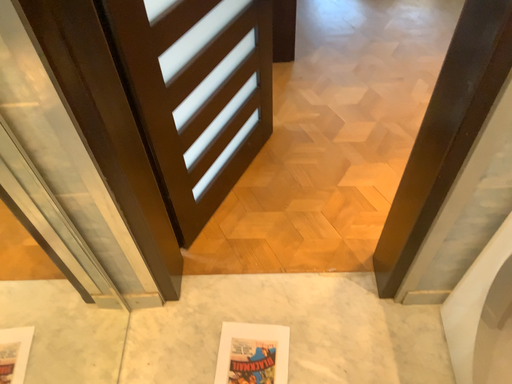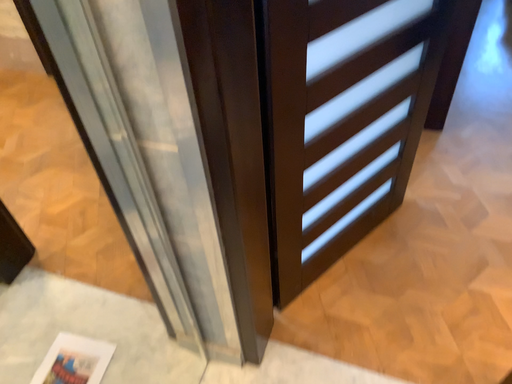
Question: Which way did the camera rotate in the video?

Choices:
 (A) rotated downward
 (B) rotated upward

Answer: (B)